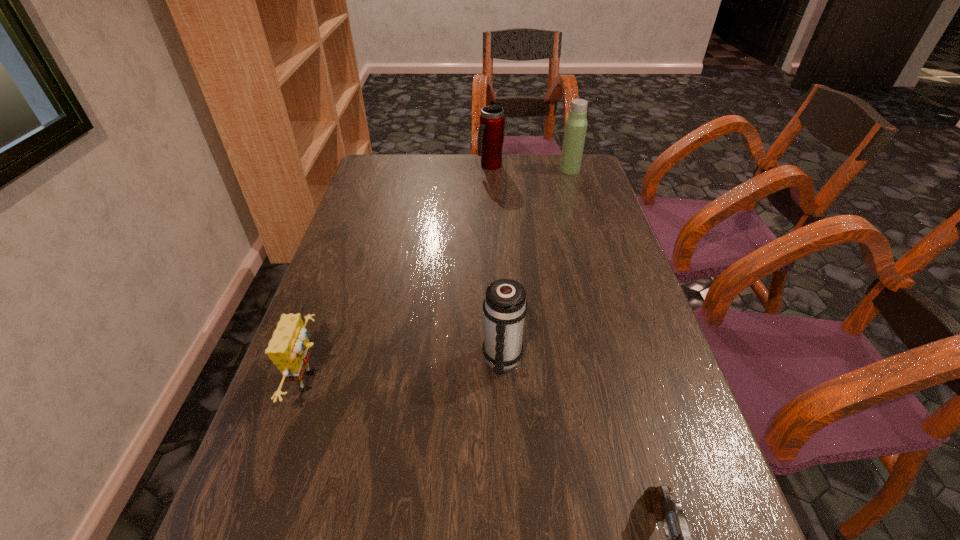
At what (x,y) coordinates should I click in order to perform the action: click on object at the far right corner. Please return your answer as a coordinate pair (x, y). Looking at the image, I should click on (576, 124).

Locate an element on the screen. Image resolution: width=960 pixels, height=540 pixels. vacant area at the far edge of the desktop is located at coordinates (480, 185).

Find the location of `vacant space at the left edge of the desktop`. vacant space at the left edge of the desktop is located at coordinates (316, 452).

Identify the location of vacant space at the right edge of the desktop. (683, 506).

Find the location of `vacant space at the far right corner of the desktop`. vacant space at the far right corner of the desktop is located at coordinates (553, 177).

Locate an element on the screen. The width and height of the screenshot is (960, 540). free space between the nearest thermos bottle and the sponge is located at coordinates (407, 370).

Choose which object is the nearest neighbor to the leftmost object. Please provide its 2D coordinates. Your answer should be formatted as a tuple, i.e. [(x, y)], where the tuple contains the x and y coordinates of a point satisfying the conditions above.

[(505, 307)]

Locate an element on the screen. The image size is (960, 540). the third closest object to the leftmost object is located at coordinates (491, 131).

Locate which thermos bottle is the second closest to the nearest thermos bottle. Please provide its 2D coordinates. Your answer should be formatted as a tuple, i.e. [(x, y)], where the tuple contains the x and y coordinates of a point satisfying the conditions above.

[(576, 124)]

Where is `thermos bottle that is the closest to the nearest thermos bottle`? The height and width of the screenshot is (540, 960). thermos bottle that is the closest to the nearest thermos bottle is located at coordinates (491, 131).